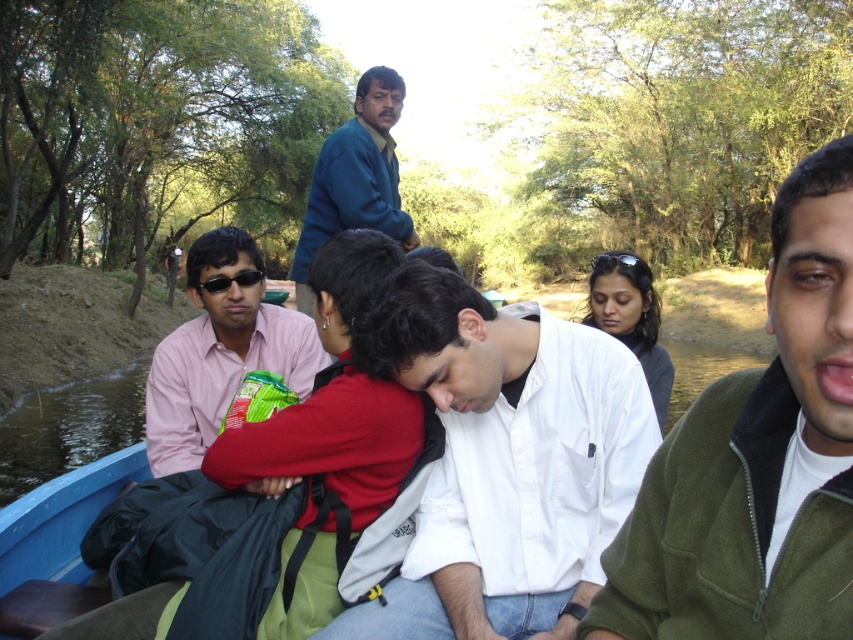
You are a photographer taking a picture of the group on the boat. You want to focus on the teal sweater at upper center. Where should you aim your camera to capture it?

You should aim your camera at point coordinates of [355,177] to capture the teal sweater at upper center.

You are on the boat and want to place a small item on both point A at point [776,307] and point B at point [222,280]. Which point is closer to you where you can reach it without moving your body?

Point A at point [776,307] is closer to the viewer than point B at point [222,280], so you can reach it without moving your body.

You are a photographer trying to capture a candid shot of the green fleece jacket at upper right and the black plastic sunglasses at left. Since you want to ensure both are in focus, you need to know their vertical positions. Which object is positioned lower in the image?

The green fleece jacket at upper right is positioned lower than the black plastic sunglasses at left.